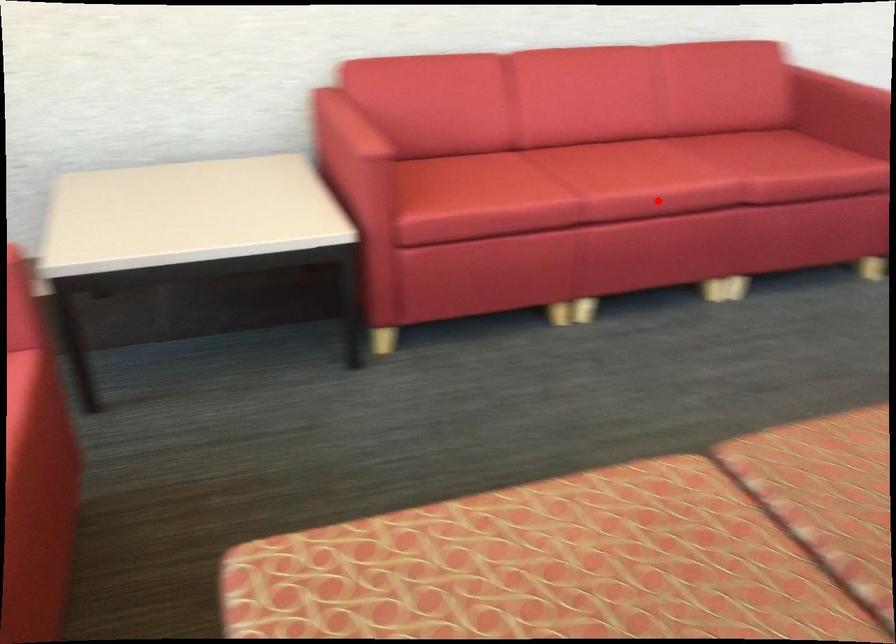
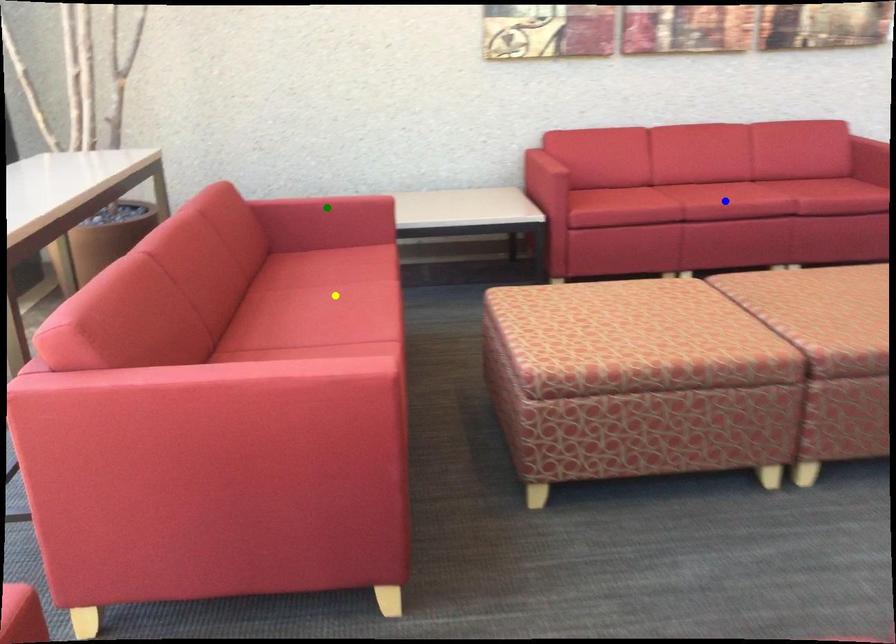
Question: I am providing you with two images of the same scene from different viewpoints. A red point is marked on the first image. You are given multiple points on the second image. Can you choose the point in image 2 that corresponds to the point in image 1?

Choices:
 (A) blue point
 (B) green point
 (C) yellow point

Answer: (A)